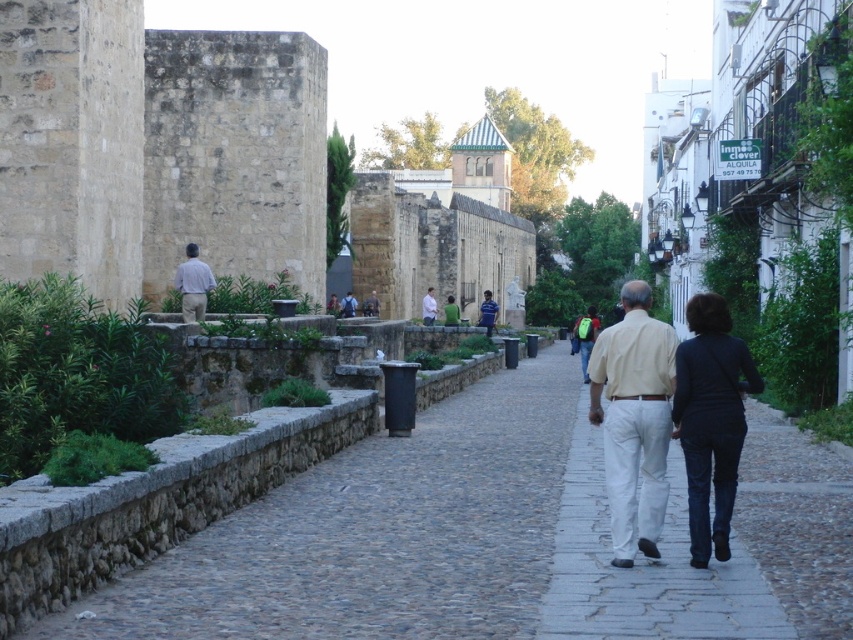
Question: Observing the image, what is the correct spatial positioning of light brown shirt at left in reference to white cotton shirt at center?

Choices:
 (A) below
 (B) above

Answer: (B)

Question: Considering the real-world distances, which object is farthest from the white cotton shirt at center?

Choices:
 (A) light brown shirt at left
 (B) beige cotton shirt at center

Answer: (B)

Question: Which point is closer to the camera?

Choices:
 (A) light brown shirt at left
 (B) beige cotton shirt at center
 (C) white cotton shirt at center

Answer: (B)

Question: Does light brown shirt at left have a greater width compared to white cotton shirt at center?

Choices:
 (A) yes
 (B) no

Answer: (A)

Question: Does light brown shirt at left have a larger size compared to white cotton shirt at center?

Choices:
 (A) no
 (B) yes

Answer: (B)

Question: Which of the following is the farthest from the observer?

Choices:
 (A) white cotton shirt at center
 (B) light brown shirt at left

Answer: (A)